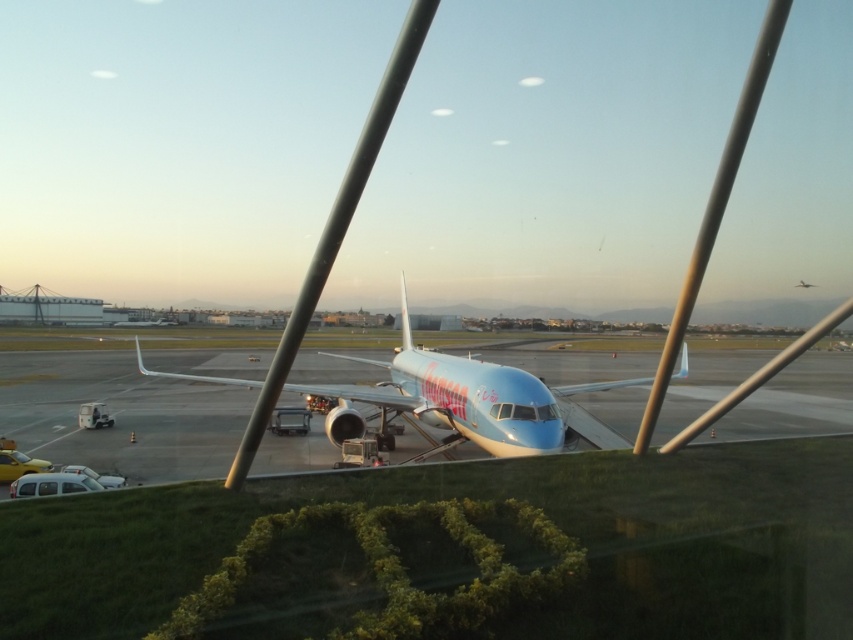
Question: Is light blue metallic airplane at center bigger than metallic silver airplane at center?

Choices:
 (A) yes
 (B) no

Answer: (A)

Question: Which point appears farthest from the camera in this image?

Choices:
 (A) (450, 355)
 (B) (802, 288)

Answer: (B)

Question: Among these points, which one is farthest from the camera?

Choices:
 (A) click(805, 284)
 (B) click(410, 408)

Answer: (A)

Question: Can you confirm if light blue metallic airplane at center is thinner than metallic silver airplane at center?

Choices:
 (A) no
 (B) yes

Answer: (A)

Question: Can you confirm if light blue metallic airplane at center is positioned to the left of metallic silver airplane at center?

Choices:
 (A) no
 (B) yes

Answer: (B)